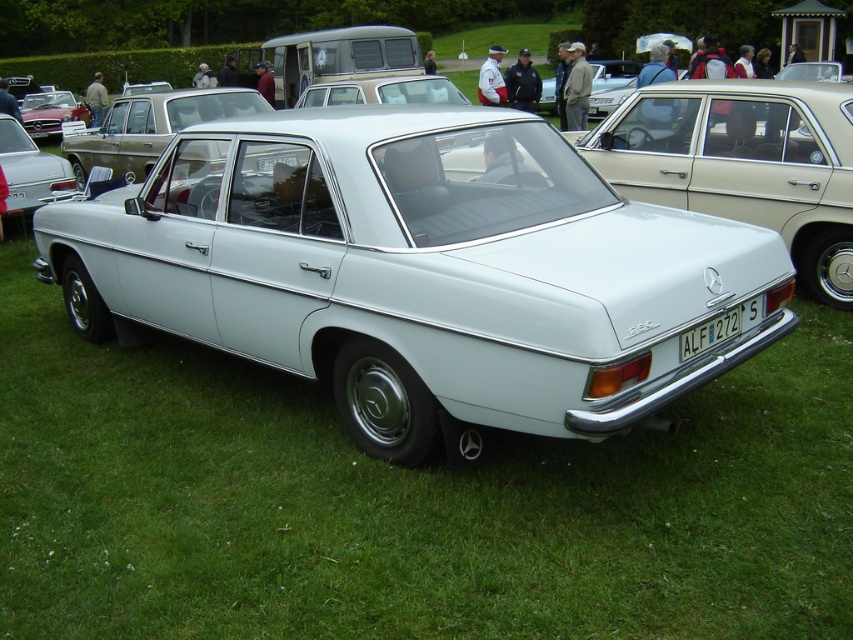
Who is lower down, metallic red convertible at upper left or white plastic license plate at center?

white plastic license plate at center is lower down.

Is metallic red convertible at upper left bigger than white plastic license plate at center?

Indeed, metallic red convertible at upper left has a larger size compared to white plastic license plate at center.

Which is behind, point (67, 115) or point (705, 326)?

Positioned behind is point (67, 115).

Identify the location of metallic red convertible at upper left. Image resolution: width=853 pixels, height=640 pixels. (50, 113).